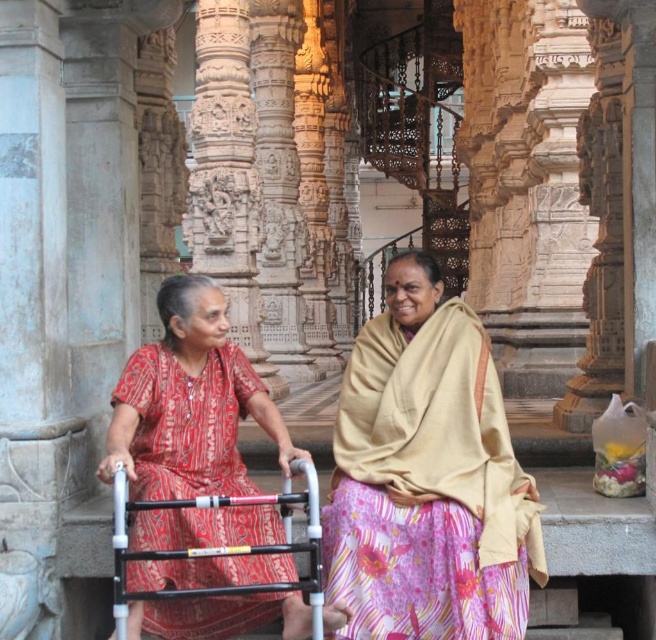
You are a photographer trying to capture the two women in the scene. You want to arrange them so that the beige fabric shawl at center and the red printed dress at center are visible. Based on their current positions, which object is positioned to the right of the other?

The beige fabric shawl at center is to the right of the red printed dress at center.

You are a photographer setting up a camera to capture both the beige fabric shawl at center and the red printed dress at center in the same frame. The camera has a maximum focus range of 4 meters. Will you be able to capture both objects clearly in one shot?

The distance between the beige fabric shawl at center and the red printed dress at center is 4.05 meters. Since the camera can only focus up to 4 meters, the objects are slightly out of the focus range. Therefore, you won cannot capture both clearly in one shot.

You are an architect designing a new temple and want to ensure accessibility for visitors with mobility aids. You observe the scene with the beige fabric shawl at center and the red printed dress at center. Which object is shorter in height and why is this important for accessibility planning?

The beige fabric shawl at center is shorter in height compared to the red printed dress at center. This is important for accessibility planning because lower obstacles like the shawl are less likely to interfere with mobility aids such as walkers, ensuring safer navigation for visitors using them.